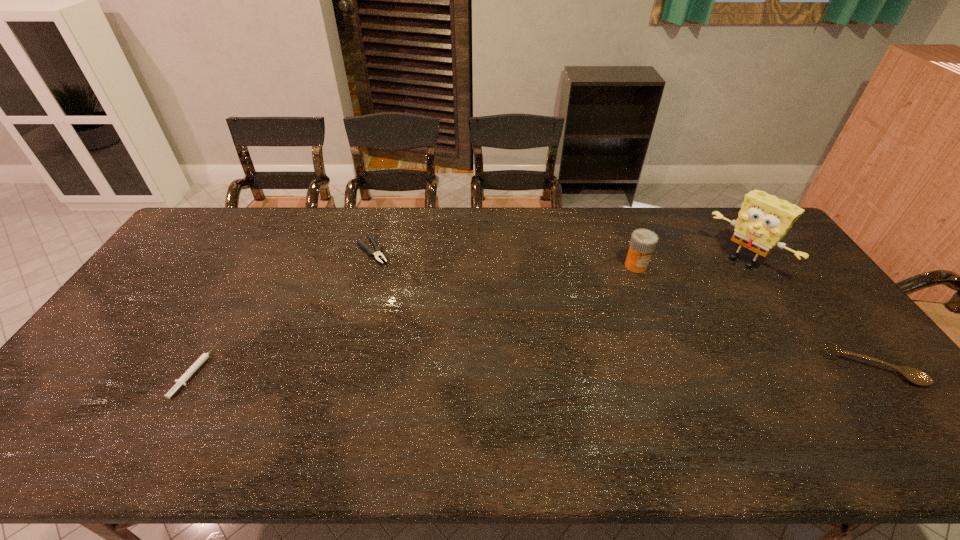
Identify the location of the second closest object to the second tallest object. (913, 375).